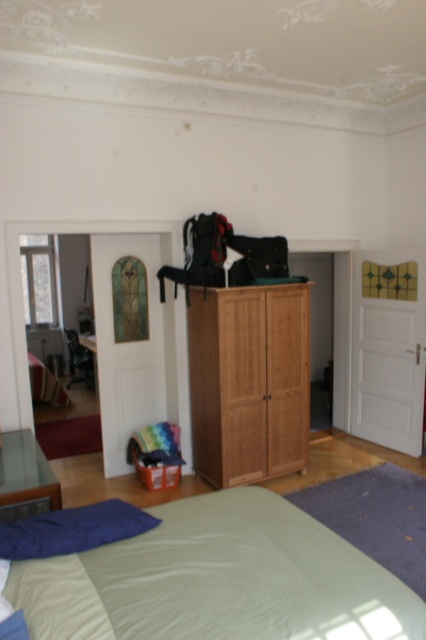
Question: Does light brown wood wardrobe at center have a larger size compared to glass transparent dresser at lower left?

Choices:
 (A) no
 (B) yes

Answer: (B)

Question: Among these points, which one is nearest to the camera?

Choices:
 (A) (258, 353)
 (B) (20, 534)
 (C) (23, 509)
 (D) (160, 612)

Answer: (D)

Question: Where is blue fabric pillow at lower left located in relation to glass transparent dresser at lower left in the image?

Choices:
 (A) below
 (B) above

Answer: (A)

Question: Which point is farther to the camera?

Choices:
 (A) glass transparent dresser at lower left
 (B) light green fabric bed at lower center

Answer: (A)

Question: Among these points, which one is nearest to the camera?

Choices:
 (A) (252, 285)
 (B) (149, 592)

Answer: (B)

Question: Does light green fabric bed at lower center have a lesser width compared to blue fabric pillow at lower left?

Choices:
 (A) yes
 (B) no

Answer: (B)